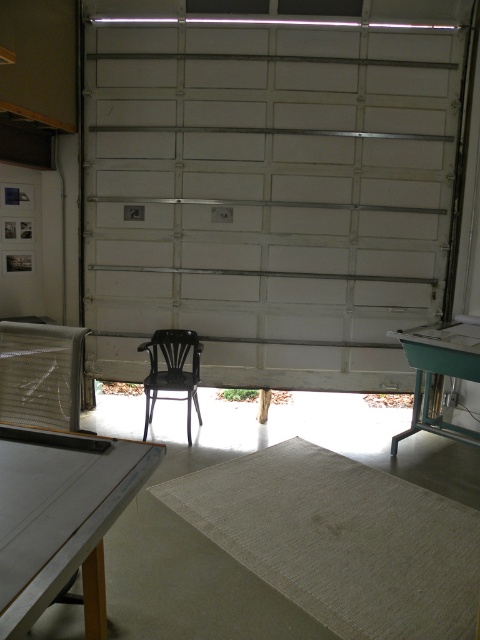
Is white glossy table at lower left shorter than metallic black chair at center?

Yes, white glossy table at lower left is shorter than metallic black chair at center.

Who is higher up, white glossy table at lower left or metallic black chair at center?

white glossy table at lower left

Does point (26, 484) come in front of point (156, 372)?

Yes, it is.

This screenshot has width=480, height=640. Identify the location of white glossy table at lower left. (60, 516).

Which is in front, point (98, 620) or point (69, 372)?

Positioned in front is point (98, 620).

Does white glossy table at lower left appear on the left side of metallic mesh chair at left?

In fact, white glossy table at lower left is to the right of metallic mesh chair at left.

Who is more forward, (x=56, y=554) or (x=0, y=326)?

Point (x=56, y=554)

The width and height of the screenshot is (480, 640). Find the location of `white glossy table at lower left`. white glossy table at lower left is located at coordinates (60, 516).

Can you confirm if white glossy table at lower left is bigger than green plastic table at right?

No, white glossy table at lower left is not bigger than green plastic table at right.

Does white glossy table at lower left have a lesser height compared to green plastic table at right?

Yes, white glossy table at lower left is shorter than green plastic table at right.

Who is more forward, [0,522] or [466,342]?

Positioned in front is point [0,522].

I want to click on white glossy table at lower left, so pyautogui.click(x=60, y=516).